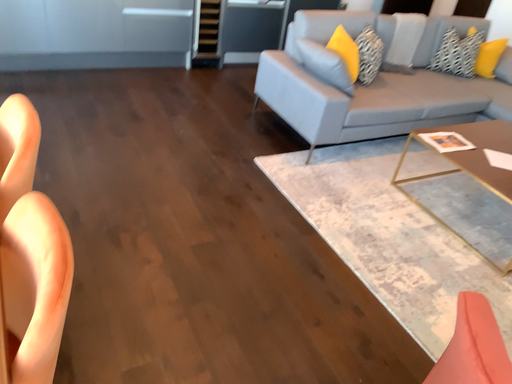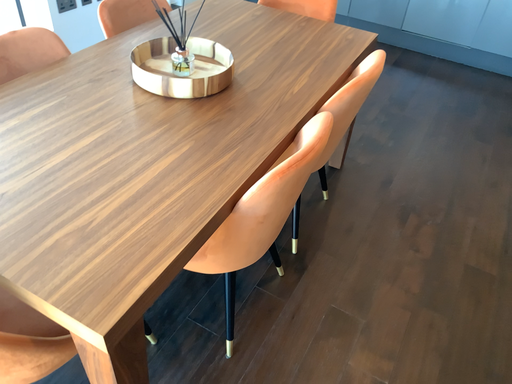
Question: How did the camera likely rotate when shooting the video?

Choices:
 (A) rotated left
 (B) rotated right

Answer: (A)